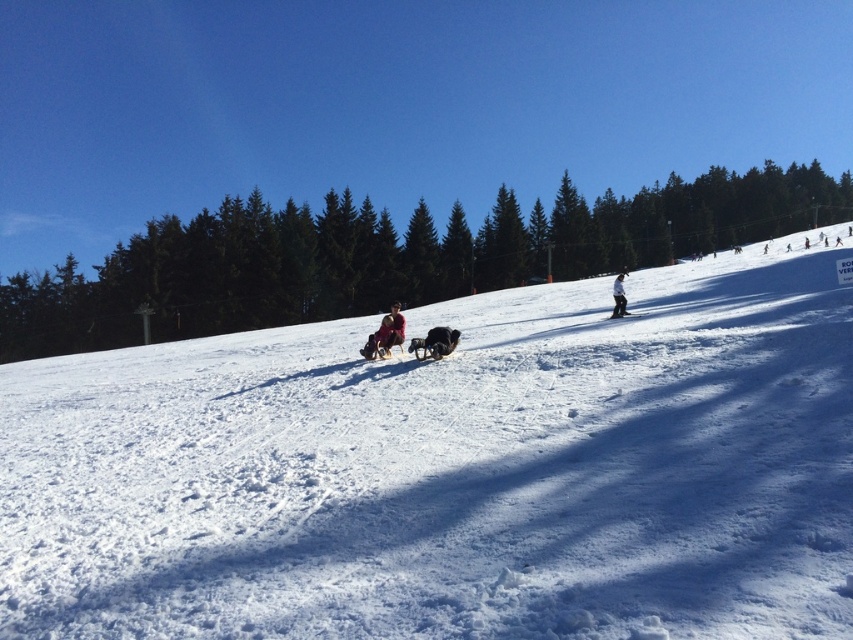
Which is more to the left, soft brown fur at center or red fabric sled at center?

red fabric sled at center is more to the left.

Between point (440, 355) and point (392, 308), which one is positioned in front?

Point (440, 355) is in front.

You are a GUI agent. You are given a task and a screenshot of the screen. Output one action in this format:
    pyautogui.click(x=<x>, y=<y>)
    Task: Click on the soft brown fur at center
    The height and width of the screenshot is (640, 853).
    Given the screenshot: What is the action you would take?
    tap(434, 342)

Does red fabric sled at center come in front of white snowboarder at center?

Yes, red fabric sled at center is closer to the viewer.

Does point (387, 330) come farther from viewer compared to point (613, 314)?

No, it is in front of (613, 314).

I want to click on red fabric sled at center, so click(389, 332).

Between white fluffy snow at center and red fabric sled at center, which one is positioned lower?

red fabric sled at center is lower down.

Is point (148, 476) closer to viewer compared to point (381, 340)?

That is True.

At what (x,y) coordinates should I click in order to perform the action: click on white fluffy snow at center. Please return your answer as a coordinate pair (x, y). The height and width of the screenshot is (640, 853). Looking at the image, I should click on (453, 470).